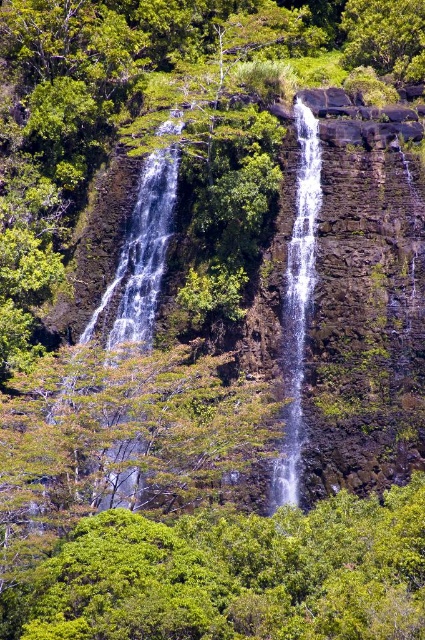
Question: Considering the relative positions of green leafy tree at center and clear water at center in the image provided, where is green leafy tree at center located with respect to clear water at center?

Choices:
 (A) right
 (B) left

Answer: (B)

Question: Does green leafy tree at center appear over white frothy water at center?

Choices:
 (A) yes
 (B) no

Answer: (B)

Question: Does green leafy tree at center have a smaller size compared to clear water at center?

Choices:
 (A) no
 (B) yes

Answer: (A)

Question: Which object is closer to the camera taking this photo?

Choices:
 (A) green leafy tree at center
 (B) white frothy water at center
 (C) clear water at center

Answer: (A)

Question: Which object is the closest to the green leafy tree at center?

Choices:
 (A) clear water at center
 (B) white frothy water at center

Answer: (B)

Question: Which object is positioned farthest from the clear water at center?

Choices:
 (A) green leafy tree at center
 (B) white frothy water at center

Answer: (A)